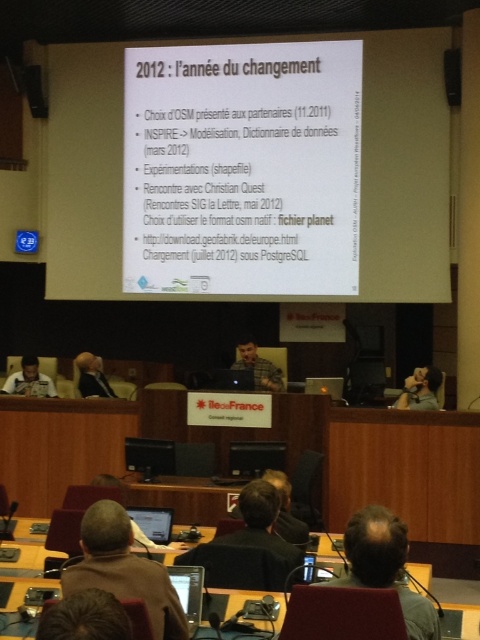
Question: Which of the following is the farthest from the observer?

Choices:
 (A) (104, 512)
 (B) (19, 378)
 (C) (86, 627)

Answer: (B)

Question: Is wooden table at center below matte black person at lower right?

Choices:
 (A) yes
 (B) no

Answer: (A)

Question: Which is nearer to the white paper at center?

Choices:
 (A) brown woolen sweater at lower left
 (B) gray hair at center

Answer: (A)

Question: Among these points, which one is nearest to the camera?

Choices:
 (A) (176, 600)
 (B) (88, 380)
 (C) (71, 628)
 (D) (433, 403)

Answer: (C)

Question: Can you confirm if white paper at center is smaller than gray hair at center?

Choices:
 (A) no
 (B) yes

Answer: (A)

Question: Is brown woolen sweater at lower left above matte black screen at lower center?

Choices:
 (A) yes
 (B) no

Answer: (A)